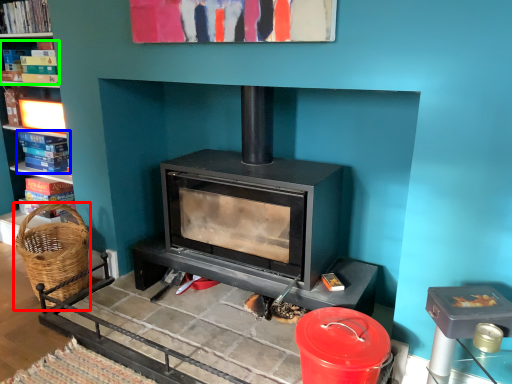
Question: Which object is positioned farthest from basket (highlighted by a red box)? Select from book (highlighted by a blue box) and book (highlighted by a green box).

Choices:
 (A) book
 (B) book

Answer: (B)